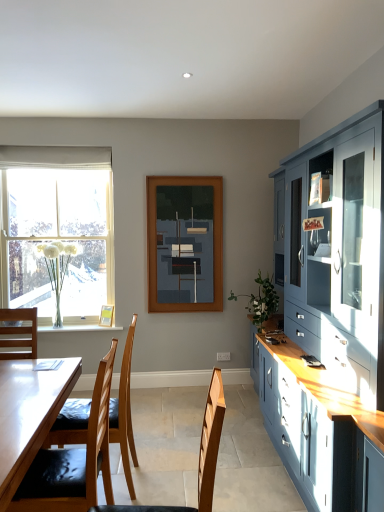
Locate an element on the screen. Image resolution: width=384 pixels, height=512 pixels. empty space that is ontop of clear glass vase at lower left (from a real-world perspective) is located at coordinates (71, 327).